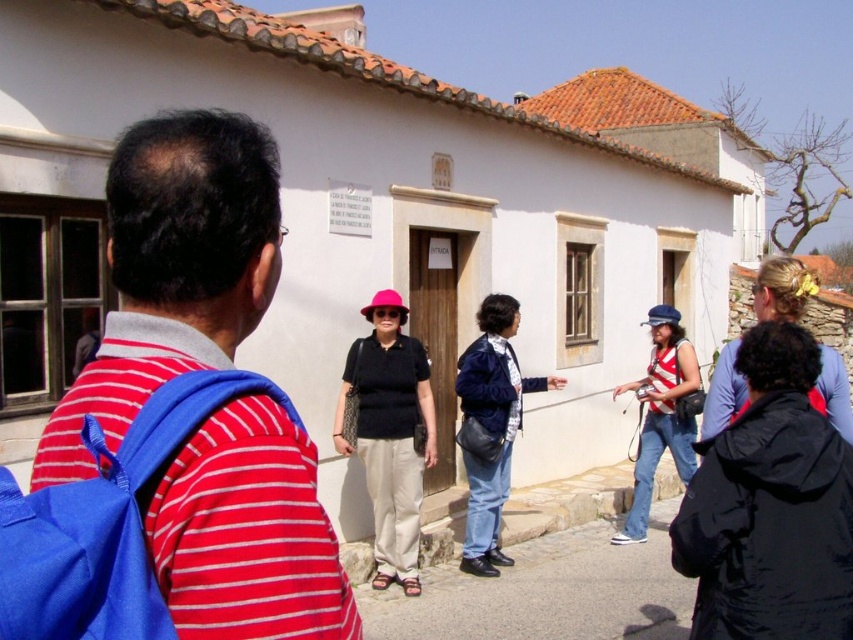
You are standing next to the man in the red and white striped polo shirt and blue backpack. You want to greet the person wearing the black matte jacket at lower right and the person in the denim jacket at center. Which direction should you walk to reach each of them first?

The black matte jacket at lower right is to the right of the denim jacket at center. To reach the denim jacket at center first, walk towards the center of the group. To reach the black matte jacket at lower right first, walk towards the right side of the group.

You are standing in the scene and want to take a photo of the striped fabric tank top at center and the black hair at upper right. Which object should you focus on first if you want to capture both in the same frame without moving the camera?

The striped fabric tank top at center has a greater height compared to the black hair at upper right, so you should focus on the striped fabric tank top at center first to ensure both are in the frame.